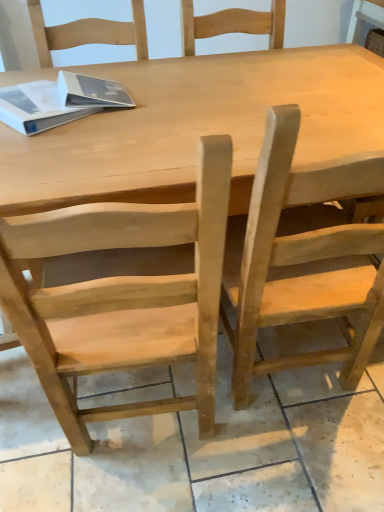
Question: Based on their sizes in the image, would you say natural wood chair at right, which ranks as the 1th chair in right-to-left order, is bigger or smaller than natural wood table at center?

Choices:
 (A) big
 (B) small

Answer: (B)

Question: Would you say natural wood chair at right, marked as the 2th chair in a left-to-right arrangement, is inside or outside natural wood table at center?

Choices:
 (A) outside
 (B) inside

Answer: (B)

Question: Considering the real-world distances, which object is closest to the natural wood chair at center, the first chair when ordered from left to right?

Choices:
 (A) natural wood chair at right, marked as the 2th chair in a left-to-right arrangement
 (B) natural wood table at center
 (C) white matte book at upper left

Answer: (A)

Question: Estimate the real-world distances between objects in this image. Which object is farther from the natural wood chair at center, which ranks as the second chair in right-to-left order?

Choices:
 (A) natural wood table at center
 (B) white matte book at upper left
 (C) natural wood chair at right, marked as the 2th chair in a left-to-right arrangement

Answer: (B)